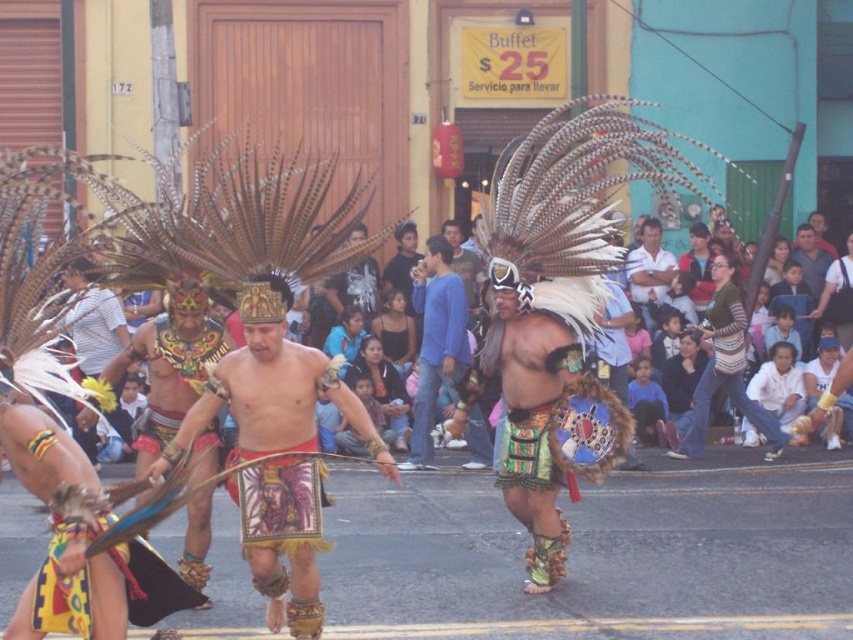
Who is more forward, (361, 422) or (421, 404)?

Point (361, 422) is in front.

Who is shorter, matte gold headdress at center or blue cotton shirt at center?

matte gold headdress at center is shorter.

The image size is (853, 640). What are the coordinates of `matte gold headdress at center` in the screenshot? It's located at (273, 401).

At what (x,y) coordinates should I click in order to perform the action: click on matte gold headdress at center. Please return your answer as a coordinate pair (x, y). This screenshot has height=640, width=853. Looking at the image, I should click on [x=273, y=401].

Is blue cotton shirt at center further to camera compared to matte black shirt at center?

That is False.

Which is more to the right, blue cotton shirt at center or matte black shirt at center?

Positioned to the right is blue cotton shirt at center.

Who is more forward, [439,253] or [408,294]?

Positioned in front is point [439,253].

Where is `blue cotton shirt at center`? The width and height of the screenshot is (853, 640). blue cotton shirt at center is located at coordinates pos(436,344).

Between shiny gold headdress at center and matte brown leather jacket at center, which one has more height?

matte brown leather jacket at center is taller.

Which is more to the right, shiny gold headdress at center or matte brown leather jacket at center?

From the viewer's perspective, matte brown leather jacket at center appears more on the right side.

Does point (171, 280) come farther from viewer compared to point (448, 232)?

No.

Where is `shiny gold headdress at center`? shiny gold headdress at center is located at coordinates (170, 364).